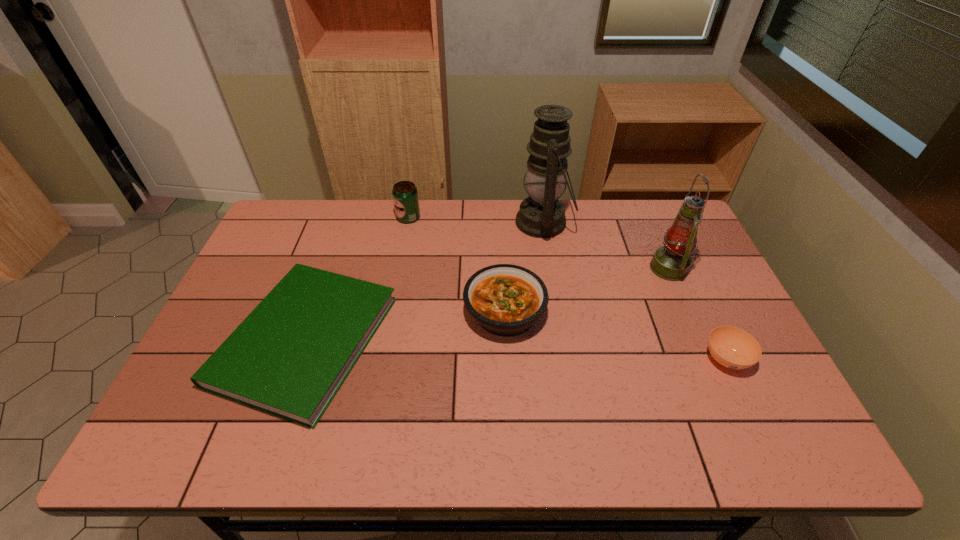
Where is `the taller oil lamp`? The width and height of the screenshot is (960, 540). the taller oil lamp is located at coordinates (541, 215).

Identify the location of the tallest object. Image resolution: width=960 pixels, height=540 pixels. pos(541,215).

This screenshot has height=540, width=960. What are the coordinates of `the right oil lamp` in the screenshot? It's located at (671, 262).

You are a GUI agent. You are given a task and a screenshot of the screen. Output one action in this format:
    pyautogui.click(x=<x>, y=<y>)
    Task: Click on the fifth shortest object
    The width and height of the screenshot is (960, 540).
    Given the screenshot: What is the action you would take?
    pyautogui.click(x=671, y=262)

Locate an element on the screen. This screenshot has height=540, width=960. the fourth shortest object is located at coordinates pos(405,195).

The height and width of the screenshot is (540, 960). In order to click on stew in this screenshot , I will do `click(506, 300)`.

Locate an element on the screen. The image size is (960, 540). soup bowl is located at coordinates (733, 348).

In order to click on the shortest object in this screenshot , I will do `click(289, 357)`.

You are a GUI agent. You are given a task and a screenshot of the screen. Output one action in this format:
    pyautogui.click(x=<x>, y=<y>)
    Task: Click on the free spot located 0.090m on the left of the left oil lamp
    
    Given the screenshot: What is the action you would take?
    pyautogui.click(x=490, y=222)

Image resolution: width=960 pixels, height=540 pixels. I want to click on free space located on the back of the nearer oil lamp, so click(x=655, y=236).